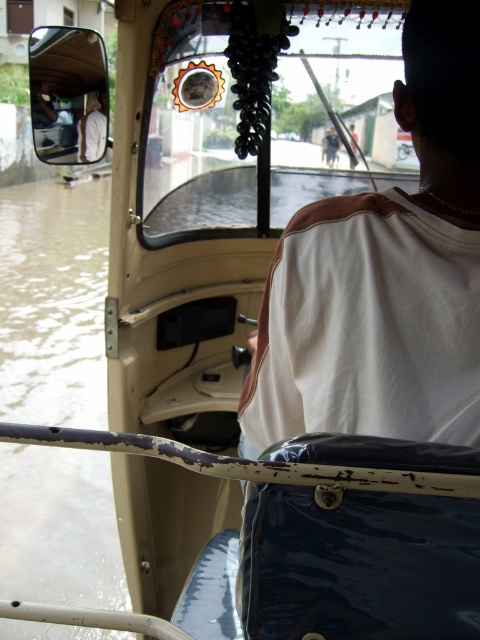
Question: Among these objects, which one is farthest from the camera?

Choices:
 (A) white fabric shirt at left
 (B) dark brown leather jacket at upper center

Answer: (B)

Question: Which point appears closest to the camera in this image?

Choices:
 (A) (98, 129)
 (B) (327, 145)

Answer: (A)

Question: Which point is farther from the camera taking this photo?

Choices:
 (A) (82, 161)
 (B) (332, 141)

Answer: (B)

Question: Considering the relative positions of white fabric shirt at left and dark brown leather jacket at upper center in the image provided, where is white fabric shirt at left located with respect to dark brown leather jacket at upper center?

Choices:
 (A) right
 (B) left

Answer: (B)

Question: Is the position of white fabric shirt at left less distant than that of dark brown leather jacket at upper center?

Choices:
 (A) yes
 (B) no

Answer: (A)

Question: Does white fabric shirt at left have a smaller size compared to dark brown leather jacket at upper center?

Choices:
 (A) yes
 (B) no

Answer: (B)